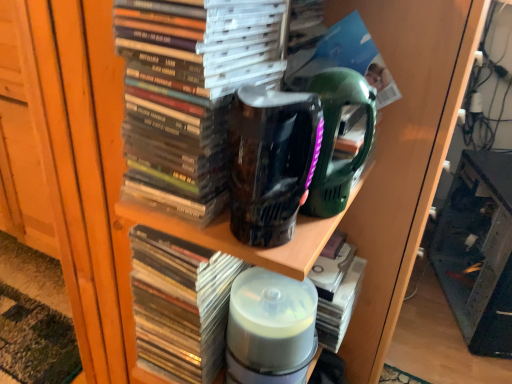
Question: Is matte black book at center, the first book from the top, not near translucent plastic books at center, which appears as the second book when ordered from the bottom?

Choices:
 (A) no
 (B) yes

Answer: (A)

Question: From the image's perspective, does matte black book at center, the first book from the top, appear higher than translucent plastic books at center, which is counted as the second book, starting from the top?

Choices:
 (A) no
 (B) yes

Answer: (B)

Question: From a real-world perspective, does matte black book at center, the first book from the top, sit lower than translucent plastic books at center, which appears as the second book when ordered from the bottom?

Choices:
 (A) no
 (B) yes

Answer: (A)

Question: Could you tell me if matte black book at center, the first book from the top, is turned towards translucent plastic books at center, which is counted as the second book, starting from the top?

Choices:
 (A) no
 (B) yes

Answer: (A)

Question: Considering the relative sizes of matte black book at center, arranged as the third book when ordered from the bottom, and translucent plastic books at center, which appears as the second book when ordered from the bottom, in the image provided, is matte black book at center, arranged as the third book when ordered from the bottom, shorter than translucent plastic books at center, which appears as the second book when ordered from the bottom,?

Choices:
 (A) yes
 (B) no

Answer: (A)

Question: From a real-world perspective, relative to black glossy mug at center, is transparent plastic cd case at center, acting as the third book starting from the top, vertically above or below?

Choices:
 (A) above
 (B) below

Answer: (B)

Question: From their relative heights in the image, would you say transparent plastic cd case at center, the first book from the bottom, is taller or shorter than black glossy mug at center?

Choices:
 (A) tall
 (B) short

Answer: (B)

Question: Is transparent plastic cd case at center, acting as the third book starting from the top, wider or thinner than black glossy mug at center?

Choices:
 (A) wide
 (B) thin

Answer: (A)

Question: Considering their positions, is transparent plastic cd case at center, the first book from the bottom, located in front of or behind black glossy mug at center?

Choices:
 (A) behind
 (B) front

Answer: (A)

Question: Considering the positions of matte black book at center, the first book from the top, and translucent plastic books at center, which appears as the second book when ordered from the bottom, in the image, is matte black book at center, the first book from the top, wider or thinner than translucent plastic books at center, which appears as the second book when ordered from the bottom,?

Choices:
 (A) wide
 (B) thin

Answer: (B)

Question: Which is correct: matte black book at center, arranged as the third book when ordered from the bottom, is inside translucent plastic books at center, which appears as the second book when ordered from the bottom, or outside of it?

Choices:
 (A) inside
 (B) outside

Answer: (B)

Question: From the image's perspective, is matte black book at center, the first book from the top, above or below translucent plastic books at center, which is counted as the second book, starting from the top?

Choices:
 (A) above
 (B) below

Answer: (A)

Question: In terms of height, does matte black book at center, arranged as the third book when ordered from the bottom, look taller or shorter compared to translucent plastic books at center, which is counted as the second book, starting from the top?

Choices:
 (A) short
 (B) tall

Answer: (A)

Question: Considering the relative positions of translucent plastic container at center and transparent glass tank at lower right in the image provided, is translucent plastic container at center to the left or to the right of transparent glass tank at lower right?

Choices:
 (A) right
 (B) left

Answer: (B)

Question: Considering the positions of point (244, 350) and point (482, 256), is point (244, 350) closer or farther from the camera than point (482, 256)?

Choices:
 (A) farther
 (B) closer

Answer: (B)